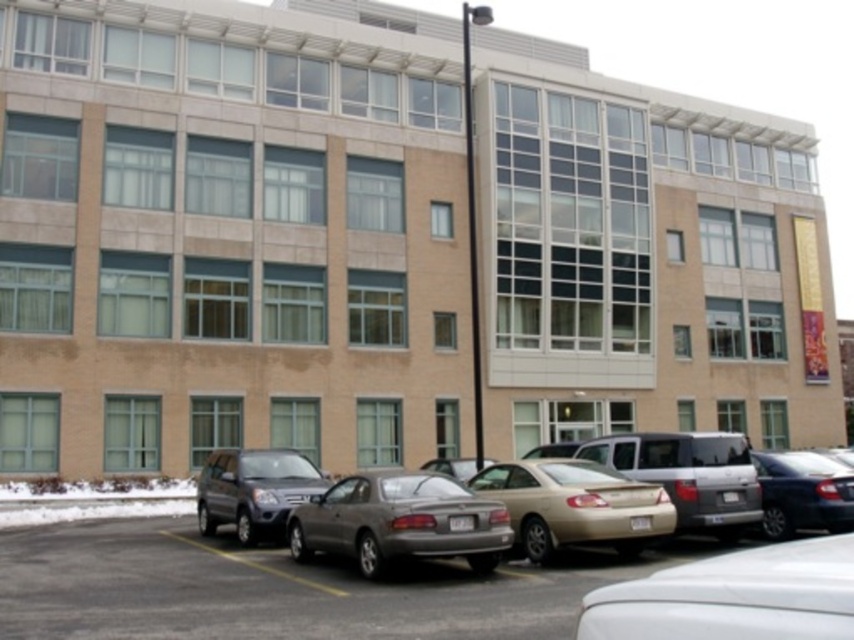
This screenshot has width=854, height=640. What do you see at coordinates (733, 596) in the screenshot?
I see `white matte sedan at lower right` at bounding box center [733, 596].

Is white matte sedan at lower right thinner than shiny dark blue sedan at right?

No, white matte sedan at lower right is not thinner than shiny dark blue sedan at right.

The height and width of the screenshot is (640, 854). Describe the element at coordinates (733, 596) in the screenshot. I see `white matte sedan at lower right` at that location.

The width and height of the screenshot is (854, 640). I want to click on white matte sedan at lower right, so click(x=733, y=596).

Is metallic silver car at center shorter than gold metallic sedan at center?

Incorrect, metallic silver car at center's height does not fall short of gold metallic sedan at center's.

Is point (174, 618) positioned after point (540, 499)?

No, it is not.

Image resolution: width=854 pixels, height=640 pixels. In order to click on metallic silver car at center in this screenshot , I will do `click(284, 588)`.

Can you confirm if white matte sedan at lower right is positioned below gold metallic sedan at center?

No, white matte sedan at lower right is not below gold metallic sedan at center.

Can you confirm if white matte sedan at lower right is bigger than gold metallic sedan at center?

No, white matte sedan at lower right is not bigger than gold metallic sedan at center.

Is point (630, 618) farther from viewer compared to point (668, 524)?

That is False.

Identify the location of white matte sedan at lower right. The image size is (854, 640). (733, 596).